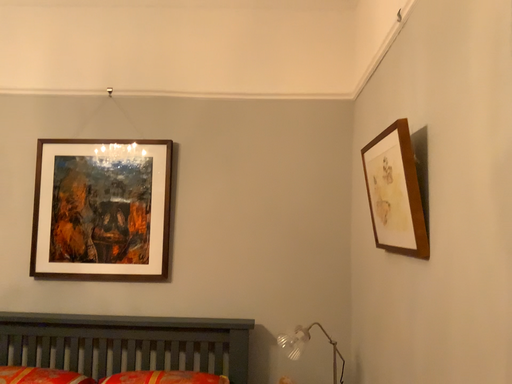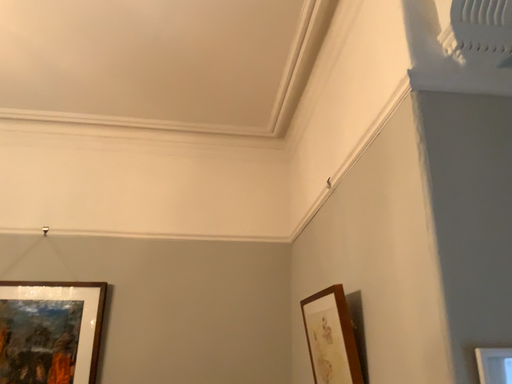
Question: Which way did the camera rotate in the video?

Choices:
 (A) rotated left
 (B) rotated right

Answer: (B)